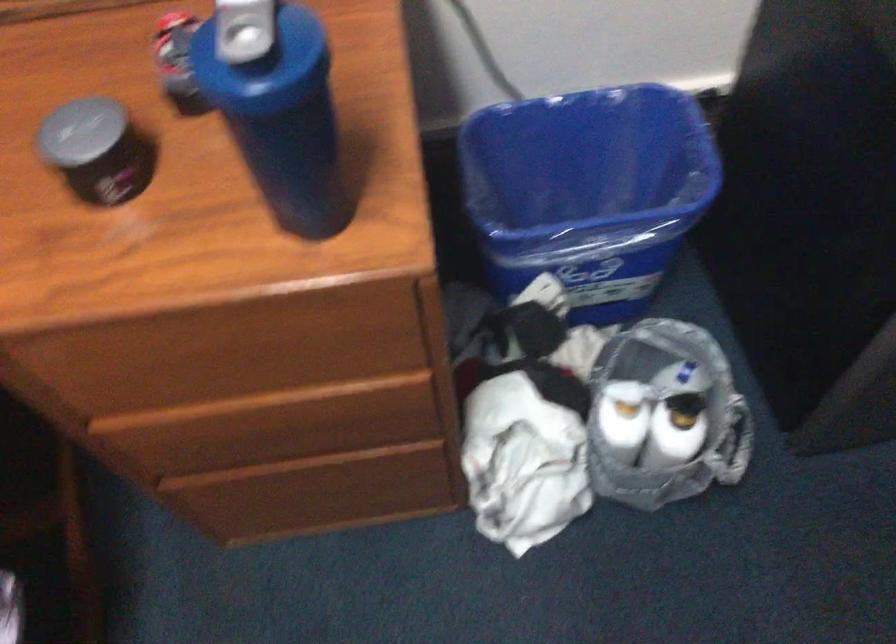
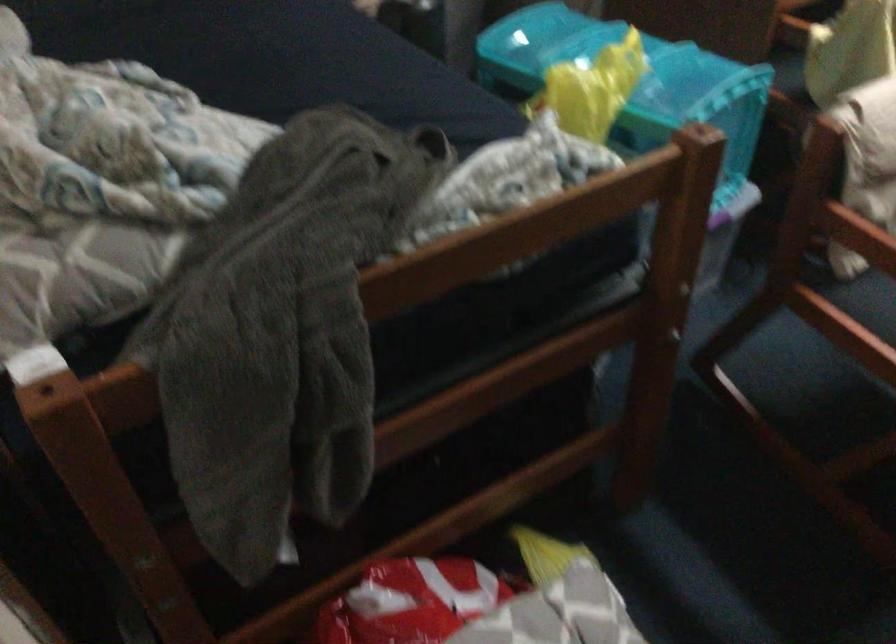
Question: What movement of the cameraman would produce the second image?

Choices:
 (A) Left
 (B) Right
 (C) Forward
 (D) Backward

Answer: (A)